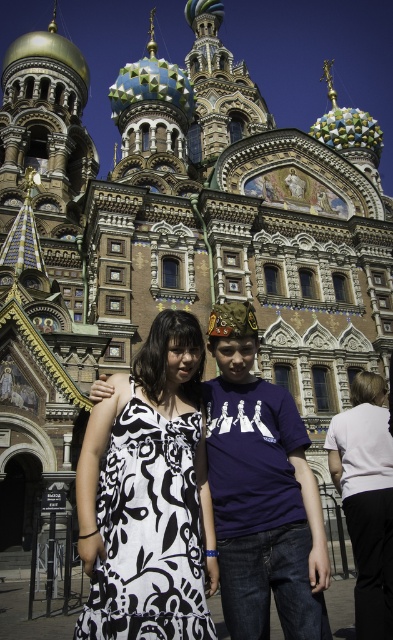
Question: Which point is closer to the camera?

Choices:
 (A) (207, 500)
 (B) (220, 524)

Answer: (B)

Question: Can you confirm if black printed dress at center is smaller than navy blue t-shirt at center?

Choices:
 (A) no
 (B) yes

Answer: (A)

Question: From the image, what is the correct spatial relationship of black printed dress at center in relation to navy blue t-shirt at center?

Choices:
 (A) above
 (B) below

Answer: (A)

Question: Which of the following is the closest to the observer?

Choices:
 (A) (128, 458)
 (B) (253, 570)

Answer: (B)

Question: Does black printed dress at center lie in front of navy blue t-shirt at center?

Choices:
 (A) no
 (B) yes

Answer: (B)